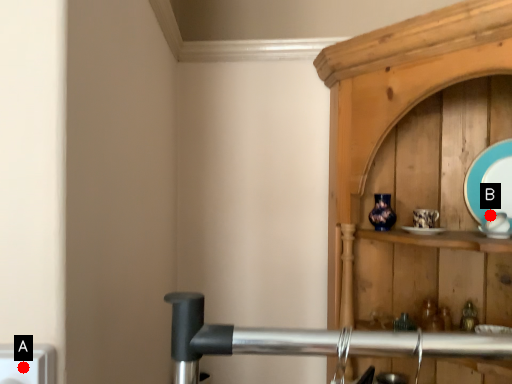
Question: Two points are circled on the image, labeled by A and B beside each circle. Among these points, which one is farthest from the camera?

Choices:
 (A) A is further
 (B) B is further

Answer: (B)